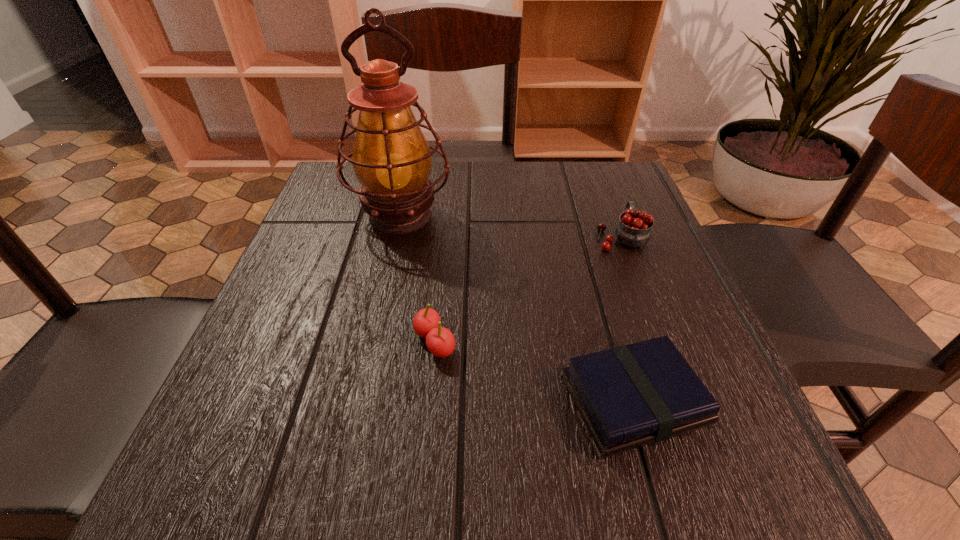
The height and width of the screenshot is (540, 960). Identify the location of oil lamp. (391, 158).

You are a GUI agent. You are given a task and a screenshot of the screen. Output one action in this format:
    pyautogui.click(x=<x>, y=<y>)
    Task: Click on the taller cherry
    
    Given the screenshot: What is the action you would take?
    click(x=634, y=229)

The height and width of the screenshot is (540, 960). I want to click on the right cherry, so click(x=634, y=229).

Where is `the left cherry`? the left cherry is located at coordinates (440, 341).

You are a GUI agent. You are given a task and a screenshot of the screen. Output one action in this format:
    pyautogui.click(x=<x>, y=<y>)
    Task: Click on the nearer cherry
    This screenshot has height=540, width=960.
    Given the screenshot: What is the action you would take?
    pyautogui.click(x=440, y=341)

Identify the location of book. (629, 396).

In order to click on free region located 0.080m on the front of the tallest object in this screenshot , I will do `click(387, 275)`.

Identify the location of free space located on the handle side of the second tallest object. This screenshot has height=540, width=960. (602, 186).

Locate an element on the screen. The height and width of the screenshot is (540, 960). vacant area located 0.080m on the handle side of the second tallest object is located at coordinates (608, 202).

Identify the location of vacant region located on the handle side of the second tallest object. (603, 188).